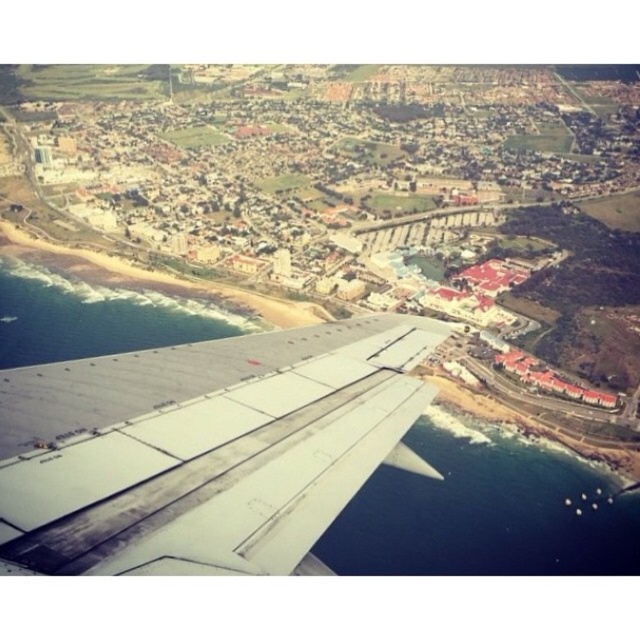
You are a pilot reviewing the plane window view. You need to locate the gray metallic wing at lower left. What are its coordinates?

The gray metallic wing at lower left is located at coordinates point (220,467).

You are a passenger sitting at the back of the airplane and looking out the window. You see a point marked at coordinates (x=22, y=472). If the airplane is flying at an altitude of 100 meters, can you estimate whether this point is closer to the wing or the beach below?

The point at coordinates (x=22, y=472) is 50.43 meters away from the viewer. Since the airplane is flying at 100 meters altitude, the point is closer to the beach below than the wing.